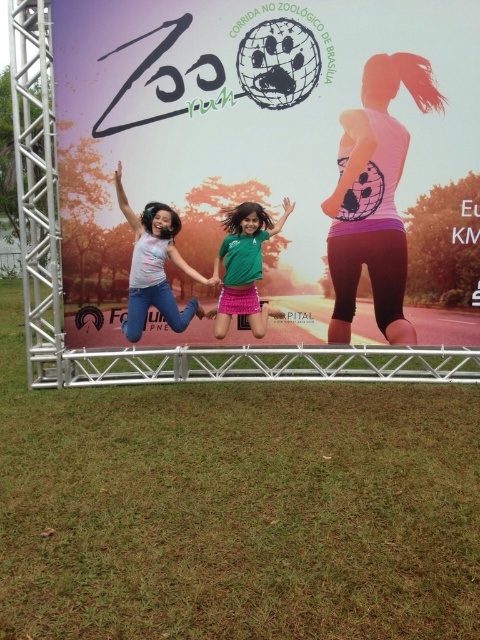
You are a photographer trying to capture a photo of both the matte white banner at center and the matte pink shirt at center in the scene. Since you want both objects to be clearly visible, which one should you focus on first to ensure proper exposure, considering their sizes?

The matte white banner at center is larger in size than the matte pink shirt at center, so you should focus on the matte white banner at center first to ensure proper exposure, as larger objects often require more precise focus and exposure adjustments to capture all details clearly.